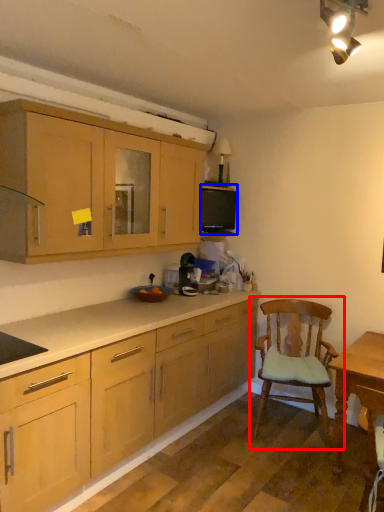
Question: Which object appears closest to the camera in this image, chair (highlighted by a red box) or appliance (highlighted by a blue box)?

Choices:
 (A) chair
 (B) appliance

Answer: (A)